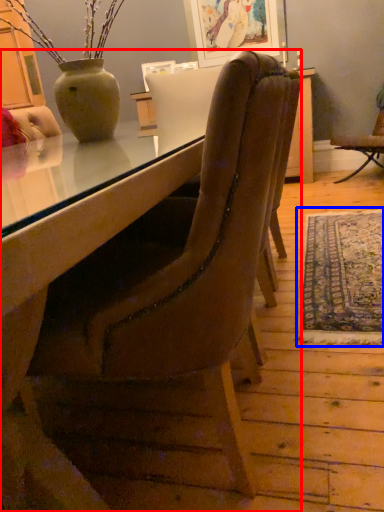
Question: Which object is further to the camera taking this photo, chair (highlighted by a red box) or mat (highlighted by a blue box)?

Choices:
 (A) chair
 (B) mat

Answer: (B)